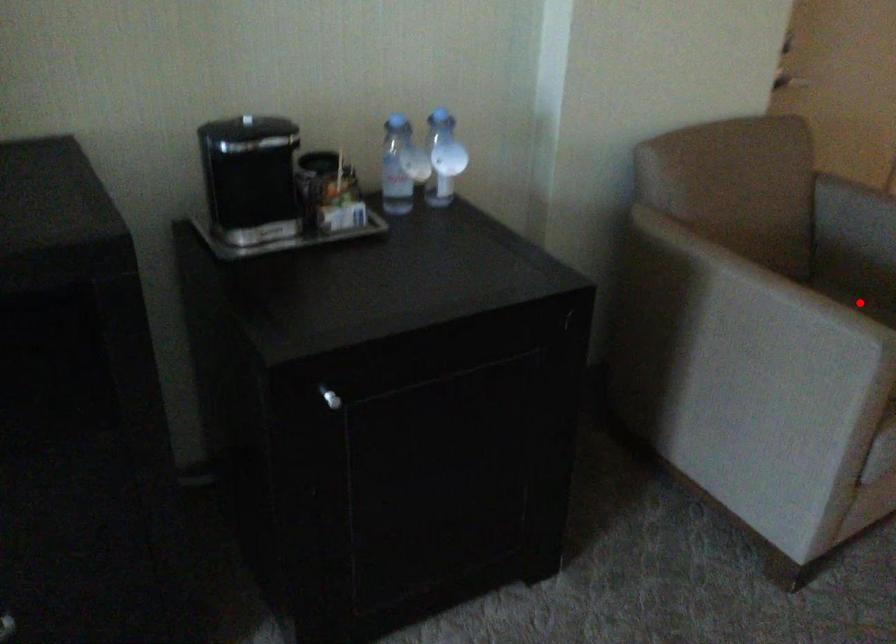
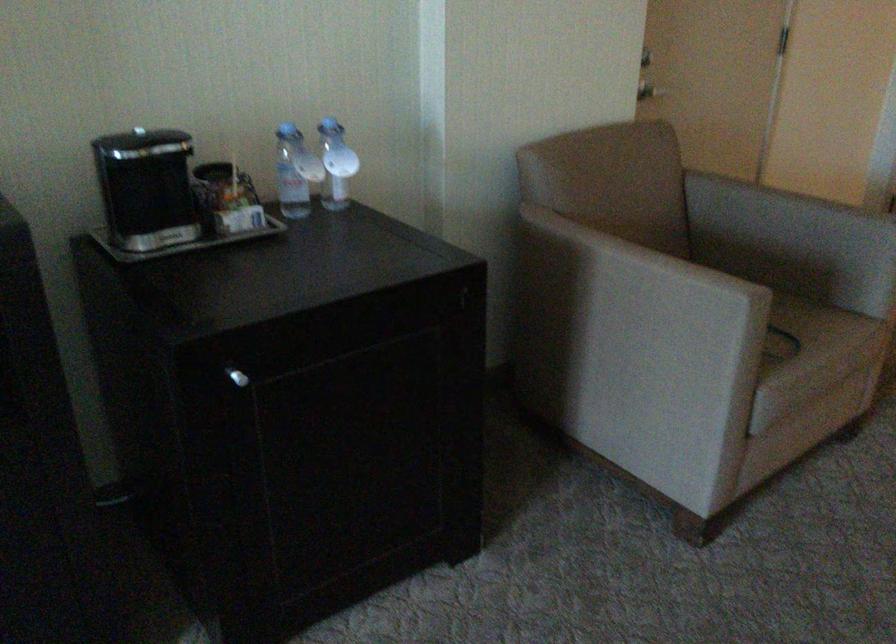
Where in the second image is the point corresponding to the highlighted location from the first image?

(734, 278)